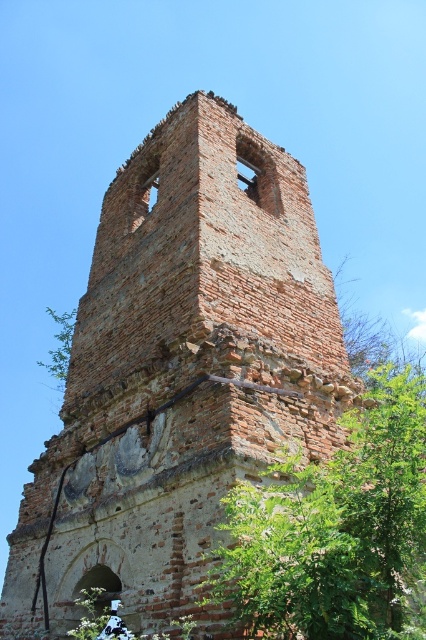
You are standing in front of an old brick structure and see a point marked at coordinates (336, 529). What is located at that point?

The point at coordinates (336, 529) marks a green leafy tree at center.

You are a gardener assessing the space between two green leafy trees. You need to plant a new shrub that requires at least 2 meters of space between them. Based on the scene, can you determine if the space between the green leafy tree at center and the green leafy tree at left is sufficient?

The green leafy tree at center has a lesser width compared to the green leafy tree at left, but the exact distance between them isn

You are standing in front of the aged brick structure and notice a green leafy tree at center. Based on its position, can you determine if the tree is closer to the large arched opening at the base or the smaller rectangular openings higher up?

The green leafy tree at center is located at point coordinates that place it closer to the smaller rectangular openings higher up compared to the large arched opening at the base.